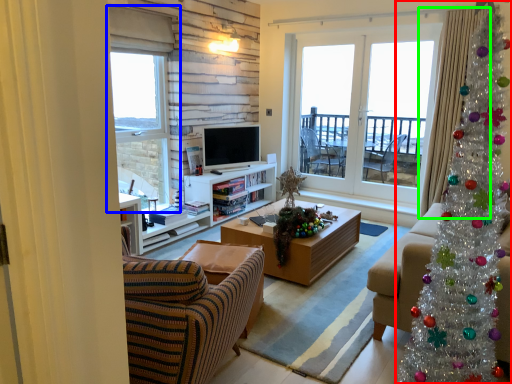
Question: Based on their relative distances, which object is farther from christmas tree (highlighted by a red box)? Choose from window (highlighted by a blue box) and curtain (highlighted by a green box).

Choices:
 (A) window
 (B) curtain

Answer: (A)